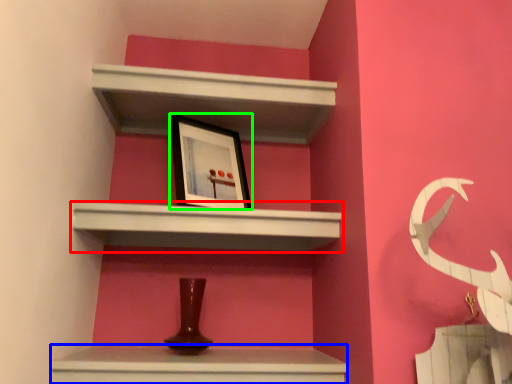
Question: Considering the real-world distances, which object is farthest from shelf (highlighted by a red box)? vanity (highlighted by a blue box) or picture frame (highlighted by a green box)?

Choices:
 (A) vanity
 (B) picture frame

Answer: (A)